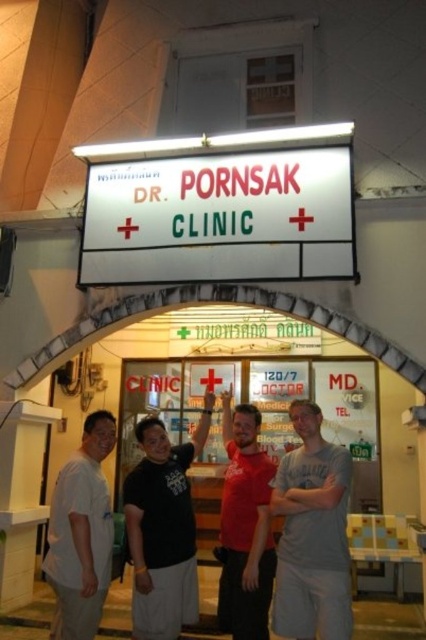
You are standing in front of Dr. Pornsak Clinic and notice a white plastic sign at center. Where exactly is this sign positioned relative to the clinic entrance?

The white plastic sign at center is located at point coordinates (219, 218) relative to the clinic entrance.